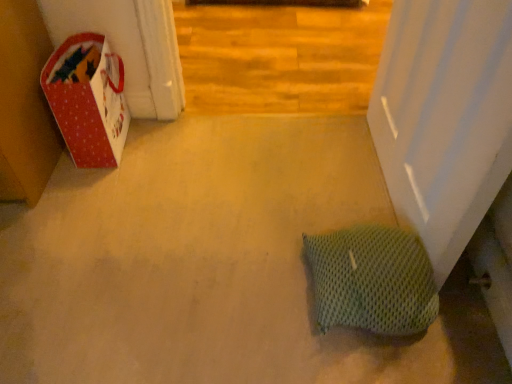
Question: From the image's perspective, relative to green mesh pillow at lower right, is red paper bag at left above or below?

Choices:
 (A) below
 (B) above

Answer: (B)

Question: From a real-world perspective, is red paper bag at left physically located above or below green mesh pillow at lower right?

Choices:
 (A) below
 (B) above

Answer: (B)

Question: Looking at the image, does red paper bag at left seem bigger or smaller compared to green mesh pillow at lower right?

Choices:
 (A) small
 (B) big

Answer: (B)

Question: Considering the positions of green mesh pillow at lower right and red paper bag at left in the image, is green mesh pillow at lower right taller or shorter than red paper bag at left?

Choices:
 (A) short
 (B) tall

Answer: (A)

Question: Considering the positions of point (379, 299) and point (90, 102), is point (379, 299) closer or farther from the camera than point (90, 102)?

Choices:
 (A) closer
 (B) farther

Answer: (A)

Question: From the image's perspective, relative to red paper bag at left, is green mesh pillow at lower right above or below?

Choices:
 (A) below
 (B) above

Answer: (A)

Question: In terms of width, does green mesh pillow at lower right look wider or thinner when compared to red paper bag at left?

Choices:
 (A) wide
 (B) thin

Answer: (B)